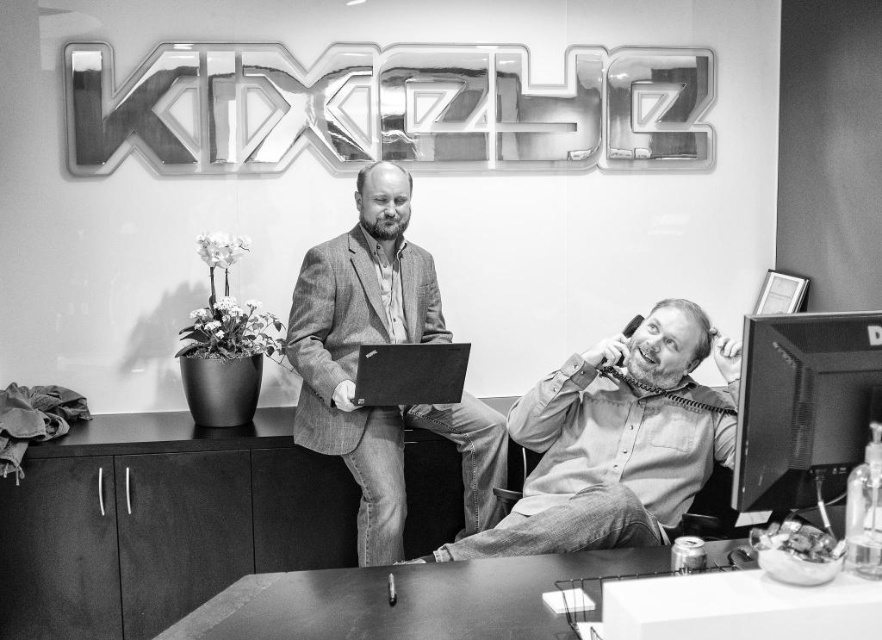
Question: Can you confirm if smooth wooden table at lower center is wider than black matte laptop at center?

Choices:
 (A) yes
 (B) no

Answer: (A)

Question: Is light gray shirt at center to the right of smooth wooden table at lower center from the viewer's perspective?

Choices:
 (A) no
 (B) yes

Answer: (B)

Question: Which point is closer to the camera?

Choices:
 (A) (395, 273)
 (B) (428, 378)
 (C) (241, 632)
 (D) (537, 388)

Answer: (C)

Question: Does light gray shirt at center appear on the right side of textured gray blazer at center?

Choices:
 (A) no
 (B) yes

Answer: (B)

Question: Which point is farther to the camera?

Choices:
 (A) matte black monitor at right
 (B) black matte laptop at center
 (C) smooth wooden table at lower center

Answer: (B)

Question: Based on their relative distances, which object is nearer to the smooth wooden table at lower center?

Choices:
 (A) light gray shirt at center
 (B) textured gray blazer at center
 (C) matte black monitor at right

Answer: (A)